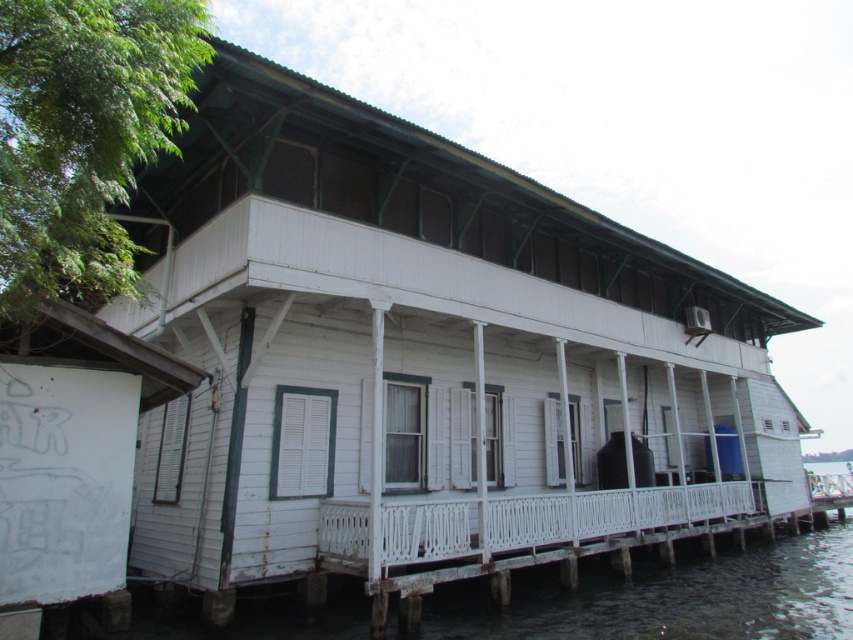
Question: Does transparent water at lower left appear on the right side of white painted wood porch at center?

Choices:
 (A) no
 (B) yes

Answer: (B)

Question: Is transparent water at lower left further to camera compared to white painted wood porch at center?

Choices:
 (A) no
 (B) yes

Answer: (A)

Question: Is transparent water at lower left above white painted wood porch at center?

Choices:
 (A) no
 (B) yes

Answer: (A)

Question: Which point is closer to the camera?

Choices:
 (A) (451, 508)
 (B) (851, 531)

Answer: (A)